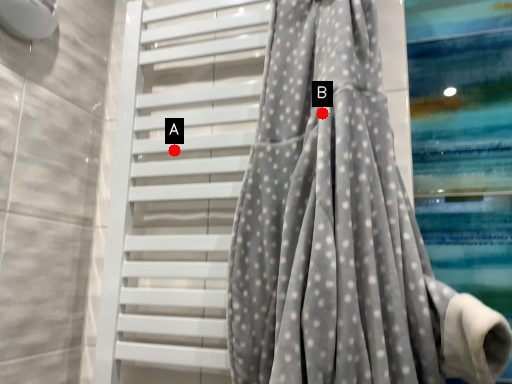
Question: Two points are circled on the image, labeled by A and B beside each circle. Among these points, which one is nearest to the camera?

Choices:
 (A) A is closer
 (B) B is closer

Answer: (B)